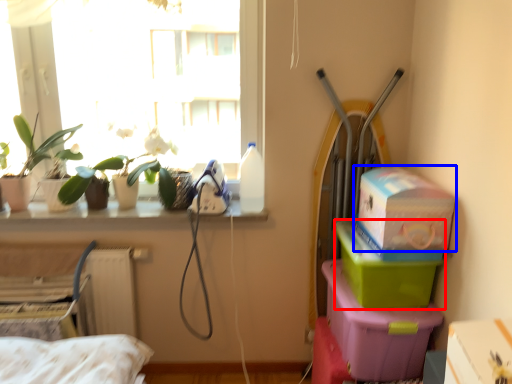
Question: Which object is further to the camera taking this photo, box (highlighted by a red box) or box (highlighted by a blue box)?

Choices:
 (A) box
 (B) box

Answer: (A)